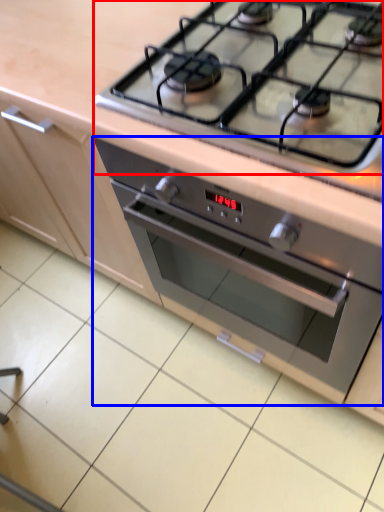
Question: Which point is closer to the camera, gas stove (highlighted by a red box) or oven (highlighted by a blue box)?

Choices:
 (A) gas stove
 (B) oven

Answer: (A)